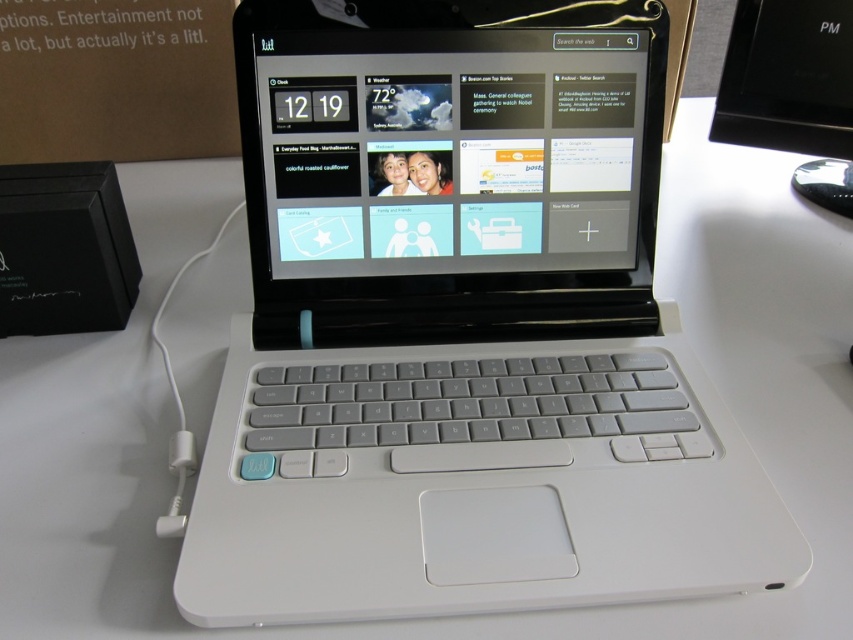
You need to place a phone charger on the desk so that it doesn not block the screen of the white matte laptop at center. Where should you place the charger relative to the laptop?

The white matte laptop at center is positioned at point (459, 320). To avoid blocking its screen, place the charger either to the right or left side of the laptop, ensuring it doesn not obstruct the screen area.

You are trying to reach for the white matte mouse at center while holding the white matte laptop at center. Which object will you need to move first to access the mouse?

You need to move the white matte laptop at center first because it is closer to you and blocking the path to the white matte mouse at center.

You are sitting at the desk and want to click the mouse. Which object is closer to you, the matte black screen at center or the white matte mouse at center?

The matte black screen at center is closer to you than the white matte mouse at center.